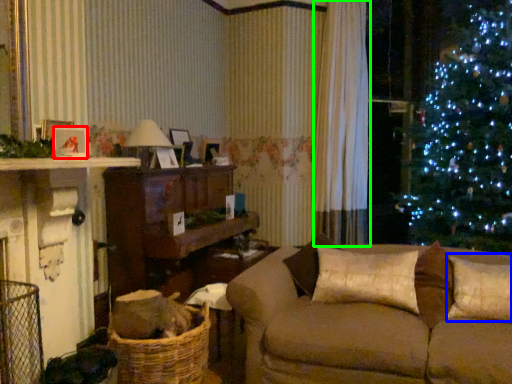
Question: Which is farther away from picture frame (highlighted by a red box)? pillow (highlighted by a blue box) or curtain (highlighted by a green box)?

Choices:
 (A) pillow
 (B) curtain

Answer: (B)